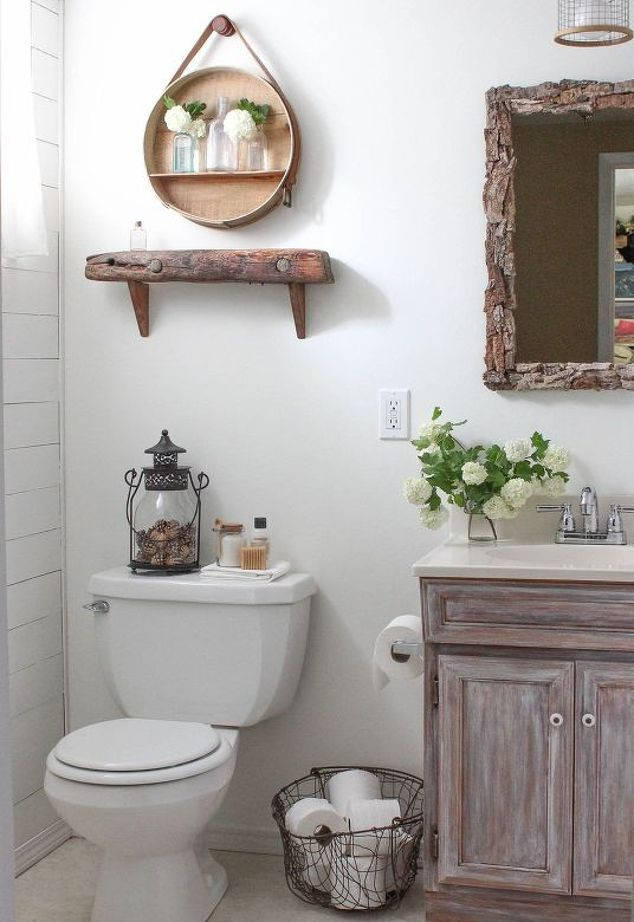
Locate an element on the screen. toilet seat is located at coordinates (146, 776), (79, 777).